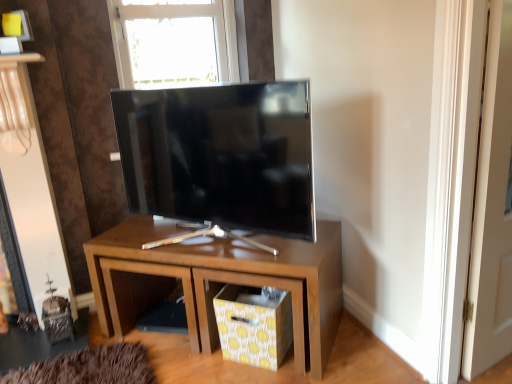
You are a GUI agent. You are given a task and a screenshot of the screen. Output one action in this format:
    pyautogui.click(x=<x>, y=<y>)
    Task: Click on the vacant region under matte black tv at center (from a real-world perspective)
    The height and width of the screenshot is (384, 512).
    Given the screenshot: What is the action you would take?
    pyautogui.click(x=194, y=244)